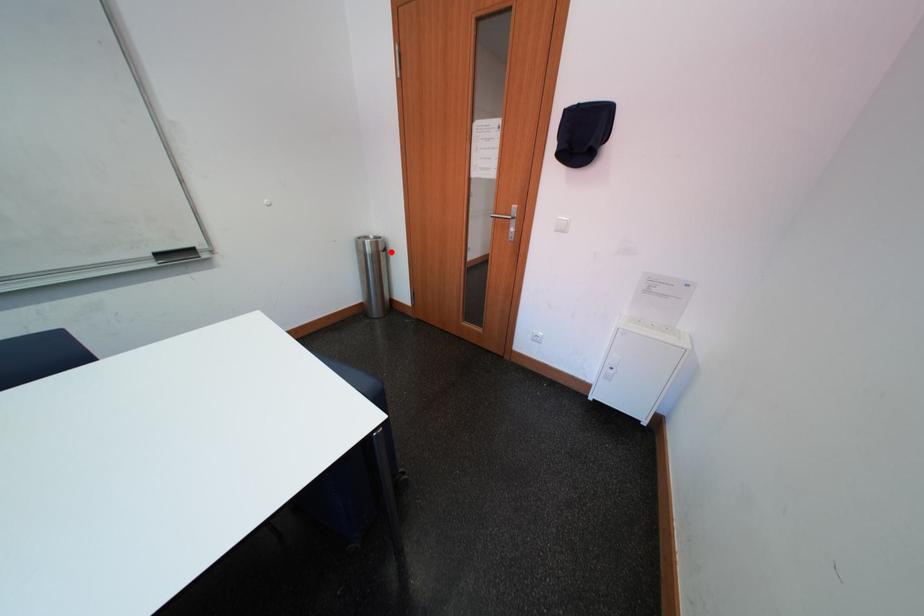
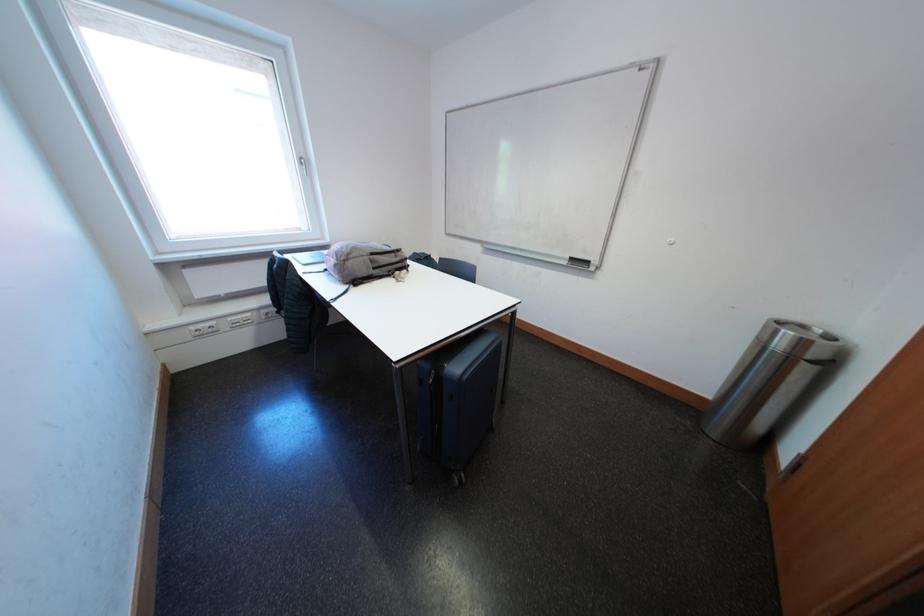
The point at the highlighted location is marked in the first image. Where is the corresponding point in the second image?

(821, 360)